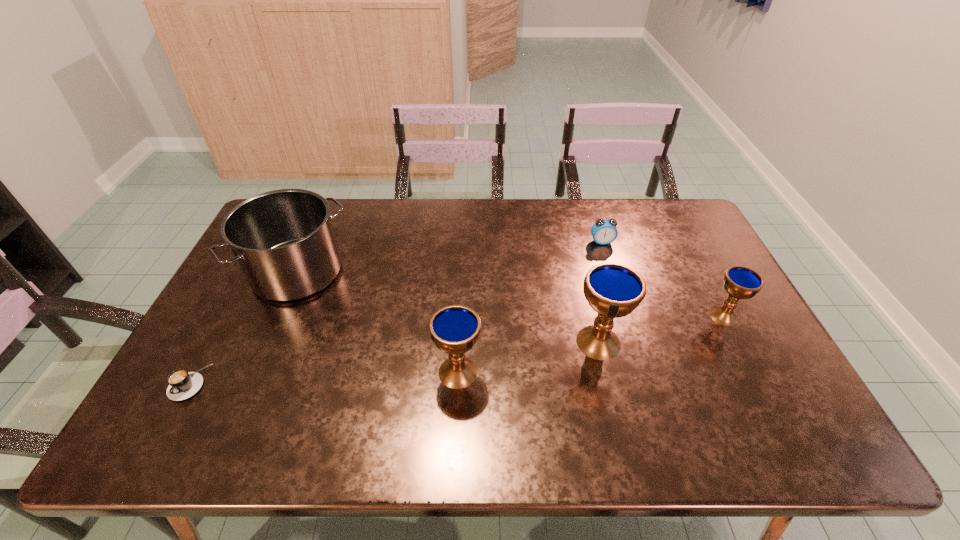
Find the location of `free spot between the fourth object from right to left and the alarm clock`. free spot between the fourth object from right to left and the alarm clock is located at coordinates (530, 307).

You are a GUI agent. You are given a task and a screenshot of the screen. Output one action in this format:
    pyautogui.click(x=<x>, y=<y>)
    Task: Click on the object that is the second closest to the second shortest chalice
    
    Given the screenshot: What is the action you would take?
    pyautogui.click(x=283, y=240)

Find the location of `object that stands as the fifth closest to the third object from left to right`. object that stands as the fifth closest to the third object from left to right is located at coordinates (740, 282).

Find the location of a particular element. This screenshot has height=540, width=960. chalice object that ranks as the third closest to the cappuccino is located at coordinates (740, 282).

At what (x,y) coordinates should I click in order to perform the action: click on chalice that is the closest to the tallest chalice. Please return your answer as a coordinate pair (x, y). Looking at the image, I should click on (x=454, y=329).

Locate an element on the screen. The image size is (960, 540). blank area in the image that satisfies the following two spatial constraints: 1. on the face of the fifth tallest object; 2. on the right side of the rightmost object is located at coordinates (625, 315).

Identify the location of free space that satisfies the following two spatial constraints: 1. on the face of the rightmost object; 2. on the left side of the alarm clock. (625, 315).